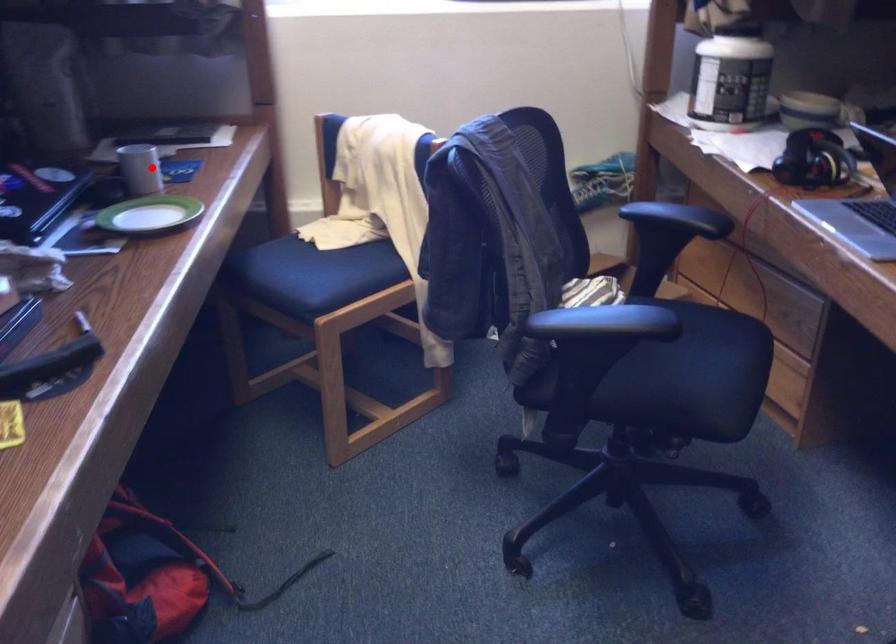
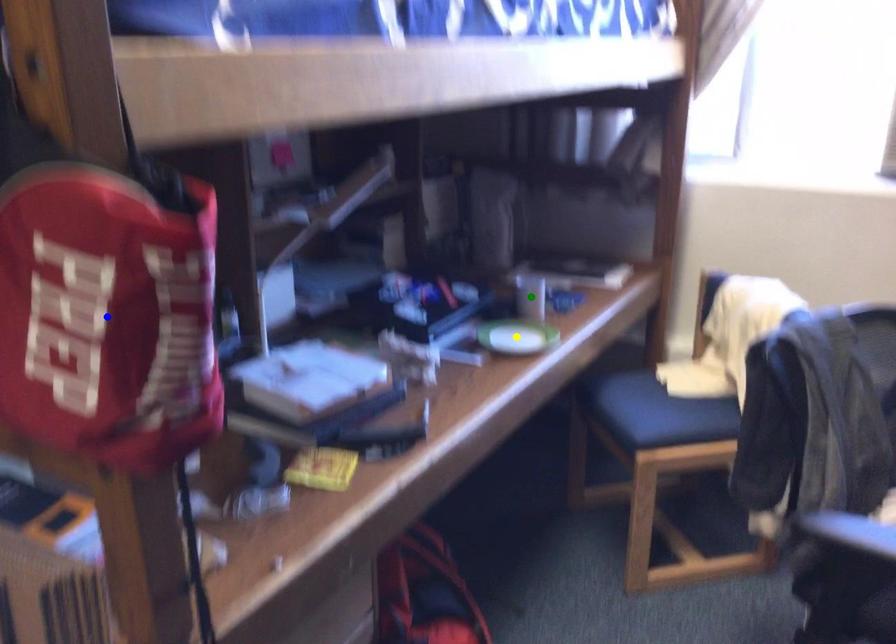
Question: I am providing you with two images of the same scene from different viewpoints. A red point is marked on the first image. You are given multiple points on the second image. In image 2, which mark is for the same physical point as the one in image 1?

Choices:
 (A) blue point
 (B) green point
 (C) yellow point

Answer: (B)